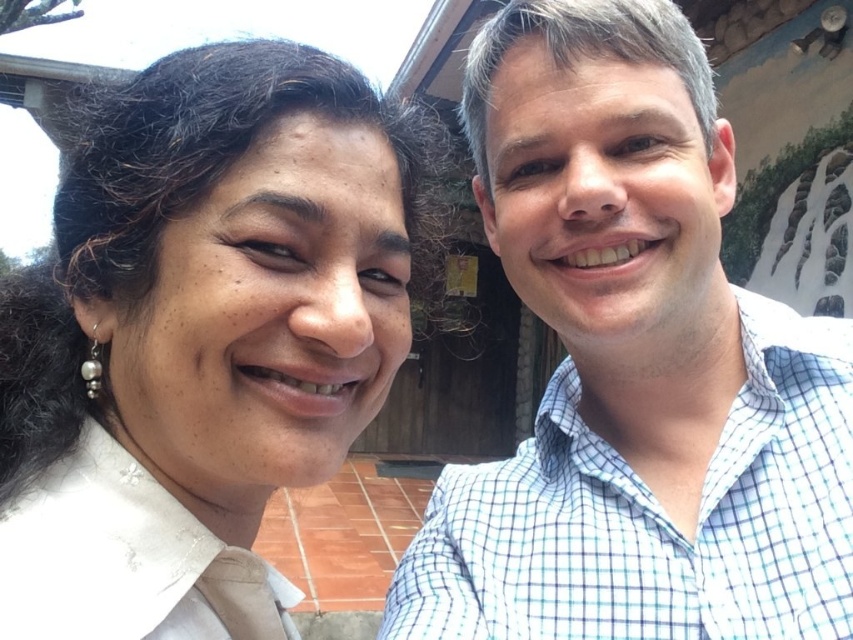
You are trying to identify the two people in the image. The white checkered shirt at right and the white matte shirt at upper left are visible. Which one is located to the right of the other?

The white checkered shirt at right is positioned on the right side of the white matte shirt at upper left.

You are standing at the point marked by the coordinates point (433, 598). You want to move to the wooden door located behind the two people in the image. Which direction should you move to reach the wooden door?

To reach the wooden door located behind the two people in the image, you should move away from the point (433, 598) towards the background since the wooden door is positioned behind them in the scene.